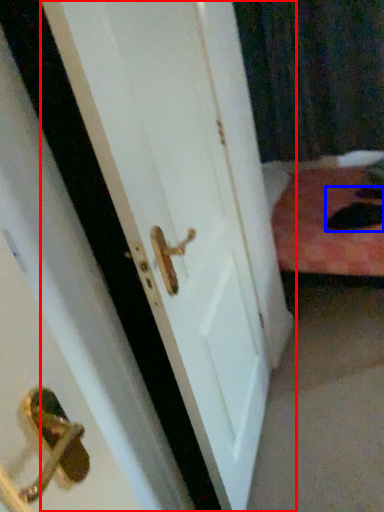
Question: Which point is closer to the camera, door (highlighted by a red box) or cat (highlighted by a blue box)?

Choices:
 (A) door
 (B) cat

Answer: (A)